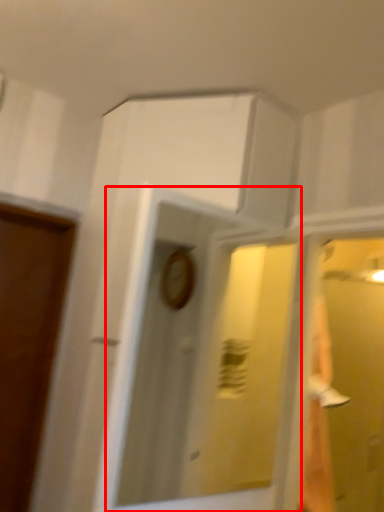
Question: From the image's perspective, where is mirror (annotated by the red box) located relative to glass door?

Choices:
 (A) below
 (B) above

Answer: (B)